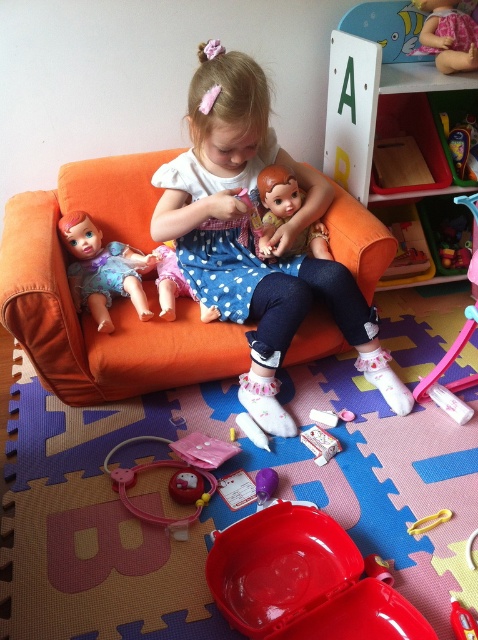
Question: Among these objects, which one is nearest to the camera?

Choices:
 (A) smooth plastic bathtub at lower center
 (B) white cardboard box at center
 (C) white polka dot dress at center

Answer: (A)

Question: Can you confirm if matte plastic doll at center is smaller than yellow plastic crayon at lower center?

Choices:
 (A) yes
 (B) no

Answer: (B)

Question: From the image, what is the correct spatial relationship of orange fabric couch at center in relation to matte plastic doll at center?

Choices:
 (A) right
 (B) left

Answer: (B)

Question: Which point is farther from the camera taking this photo?

Choices:
 (A) (238, 561)
 (B) (17, 252)
 (C) (319, 451)

Answer: (C)

Question: Estimate the real-world distances between objects in this image. Which object is farther from the white polka dot dress at center?

Choices:
 (A) matte plastic doll at left
 (B) orange fabric couch at center

Answer: (A)

Question: Does smooth plastic bathtub at lower center have a smaller size compared to matte plastic doll at left?

Choices:
 (A) no
 (B) yes

Answer: (B)